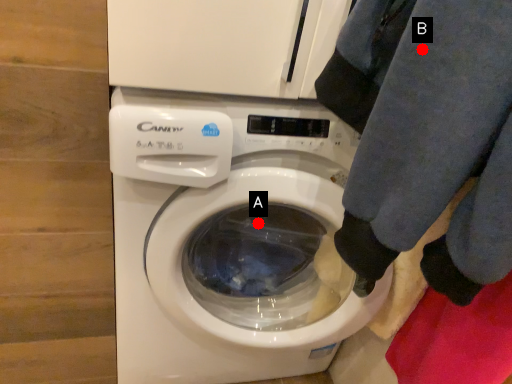
Question: Two points are circled on the image, labeled by A and B beside each circle. Which point appears farthest from the camera in this image?

Choices:
 (A) A is further
 (B) B is further

Answer: (A)